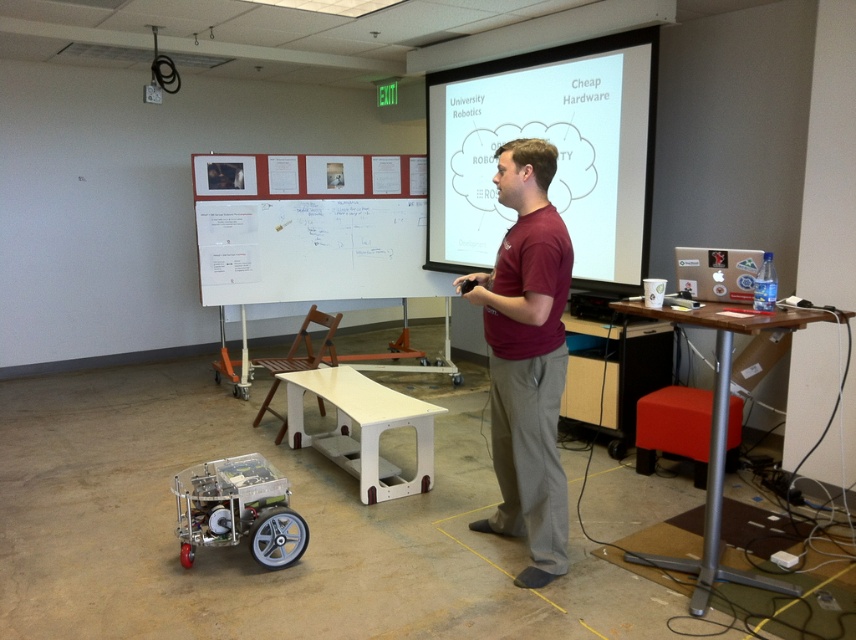
Question: Which point appears closest to the camera in this image?

Choices:
 (A) (652, 422)
 (B) (807, 314)
 (C) (464, 180)
 (D) (541, 189)

Answer: (B)

Question: Does metallic transparent robot at lower left appear over red fabric stool at lower right?

Choices:
 (A) yes
 (B) no

Answer: (B)

Question: Which is nearer to the red fabric stool at lower right?

Choices:
 (A) white matte projection screen at upper center
 (B) maroon fabric shirt at center
 (C) wooden table at right
 (D) white matte table at center

Answer: (C)

Question: Can you confirm if metallic transparent robot at lower left is positioned to the left of wooden table at right?

Choices:
 (A) yes
 (B) no

Answer: (A)

Question: Which is nearer to the wooden table at right?

Choices:
 (A) white matte table at center
 (B) maroon fabric shirt at center

Answer: (B)

Question: Is white matte table at center to the left of wooden table at right from the viewer's perspective?

Choices:
 (A) no
 (B) yes

Answer: (B)